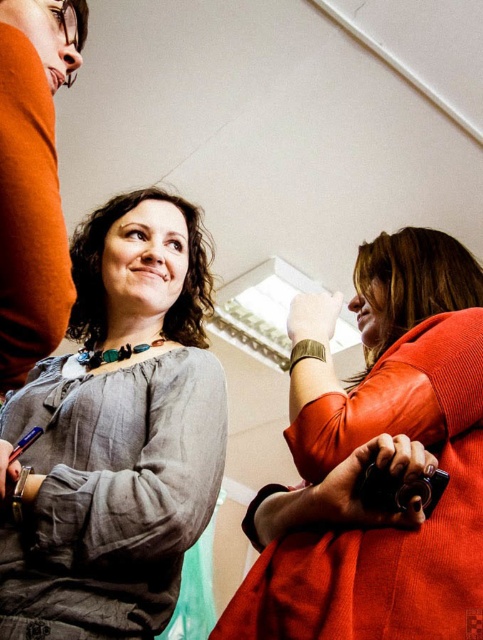
You are standing in the room and see the point at coordinates (388, 609). If you want to place a 12 inch wide book on the floor at that point, will it fit without overlapping the edges?

The point at coordinates (388, 609) is 29.06 inches away from you. Since the book is 12 inches wide, it can be placed there as long as there is enough space around the point to accommodate its width. However, without knowing the exact dimensions of the room or the surrounding objects, it is impossible to determine if the book will fit without overlapping the edges.

You are standing in the room and want to hand a document to both people wearing the matte gray blouse at center and the matte orange sweater at right. If you need to place the document on the floor between them, which direction should you walk to ensure the document is closer to the shorter person?

The matte gray blouse at center is much taller than the matte orange sweater at right, so you should walk towards the right side to place the document closer to the matte orange sweater at right, who is shorter.

You are standing in the room and looking up at the scene. There is a point at coordinate (117, 433). Which object does this point belong to?

The point at coordinate (117, 433) is on the matte gray blouse at center.